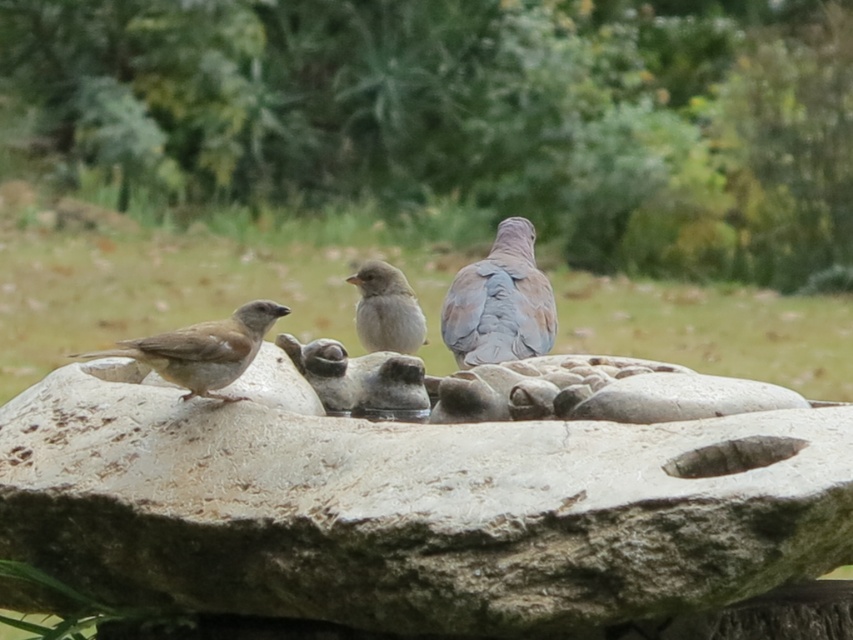
Which is more to the left, gray feathered dove at center or gray matte sparrow at center?

gray matte sparrow at center

From the picture: Which of these two, gray feathered dove at center or gray matte sparrow at center, stands taller?

gray feathered dove at center

Is point (473, 317) behind point (401, 304)?

Yes, point (473, 317) is farther from viewer.

You are a GUI agent. You are given a task and a screenshot of the screen. Output one action in this format:
    pyautogui.click(x=<x>, y=<y>)
    Task: Click on the gray feathered dove at center
    
    Given the screenshot: What is the action you would take?
    pyautogui.click(x=500, y=301)

Is brown matte sparrow at left taller than gray matte sparrow at center?

In fact, brown matte sparrow at left may be shorter than gray matte sparrow at center.

Which is in front, point (247, 320) or point (424, 332)?

Point (247, 320)

At what (x,y) coordinates should I click in order to perform the action: click on brown matte sparrow at left. Please return your answer as a coordinate pair (x, y). The height and width of the screenshot is (640, 853). Looking at the image, I should click on (202, 349).

In the scene shown: Is rough stone bird bath at center smaller than gray feathered dove at center?

No, rough stone bird bath at center is not smaller than gray feathered dove at center.

Between rough stone bird bath at center and gray feathered dove at center, which one has less height?

Standing shorter between the two is gray feathered dove at center.

Is point (505, 378) positioned in front of point (485, 292)?

Yes.

Identify the location of rough stone bird bath at center. (427, 493).